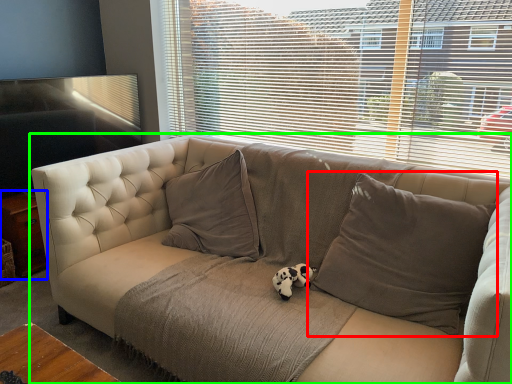
Question: Estimate the real-world distances between objects in this image. Which object is closer to pillow (highlighted by a red box), table (highlighted by a blue box) or studio couch (highlighted by a green box)?

Choices:
 (A) table
 (B) studio couch

Answer: (B)